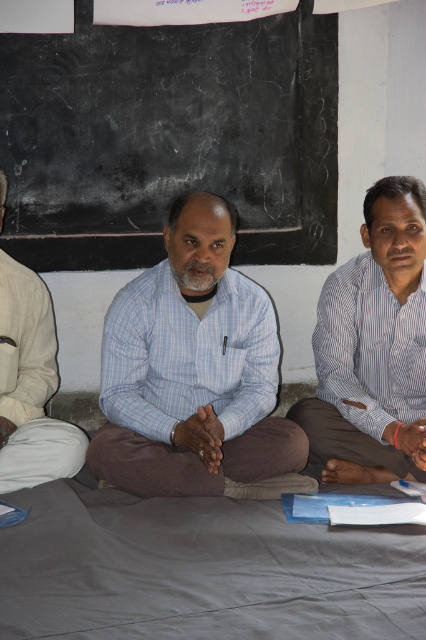
Question: Is black chalkboard at upper center to the right of light blue checkered shirt at center from the viewer's perspective?

Choices:
 (A) no
 (B) yes

Answer: (B)

Question: Which object appears closest to the camera in this image?

Choices:
 (A) black chalkboard at upper center
 (B) white striped shirt at right

Answer: (B)

Question: Which point is farther to the camera?

Choices:
 (A) (238, 492)
 (B) (184, 179)
 (C) (409, 298)
 (D) (11, 413)

Answer: (B)

Question: Which object is the closest to the blue checkered shirt at center?

Choices:
 (A) white striped shirt at right
 (B) black chalkboard at upper center

Answer: (A)

Question: Does black chalkboard at upper center have a lesser width compared to blue checkered shirt at center?

Choices:
 (A) yes
 (B) no

Answer: (B)

Question: Where is blue checkered shirt at center located in relation to white striped shirt at right in the image?

Choices:
 (A) above
 (B) below

Answer: (B)